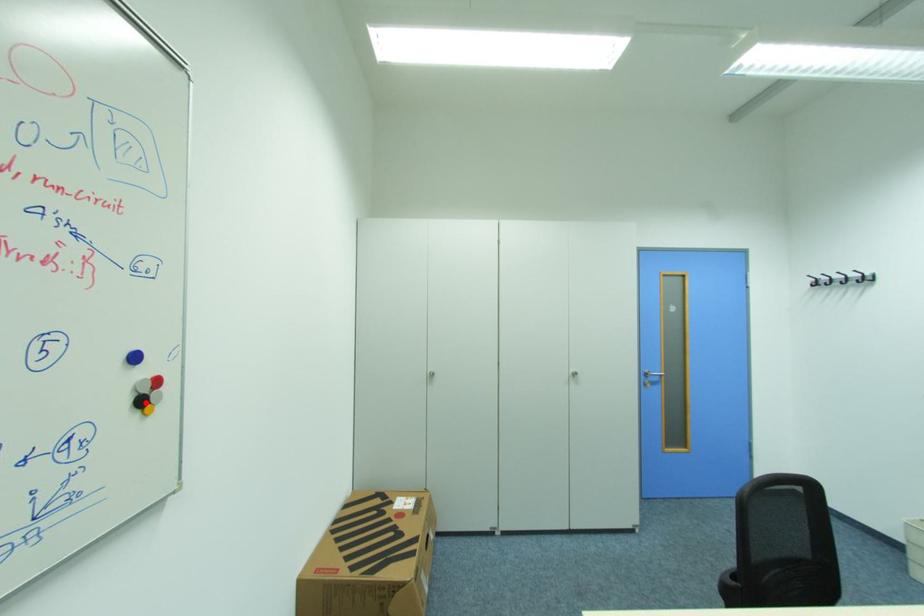
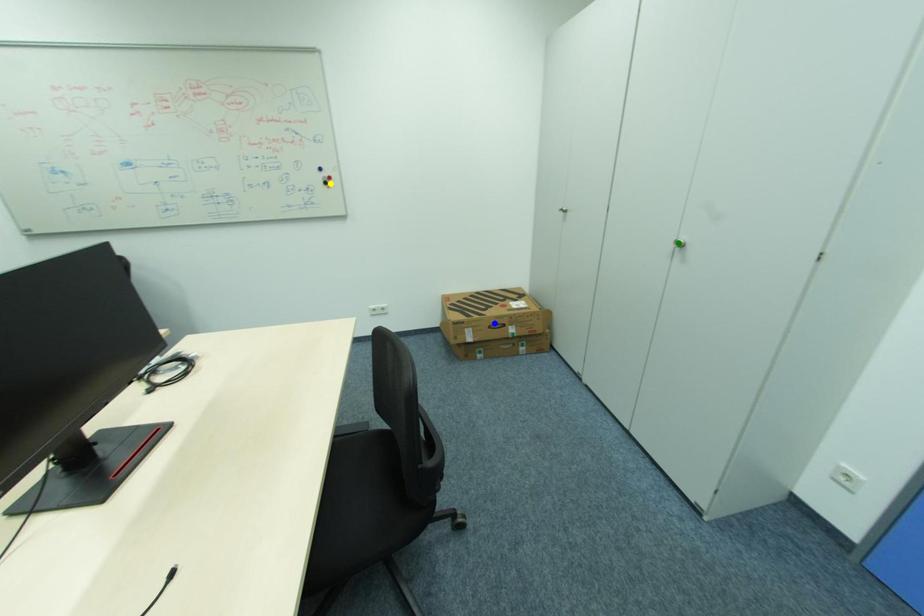
Question: I am providing you with two images of the same scene from different viewpoints. A red point is marked on the first image. You are given multiple points on the second image. Which mark in image 2 goes with the point in image 1?

Choices:
 (A) yellow point
 (B) green point
 (C) blue point

Answer: (A)